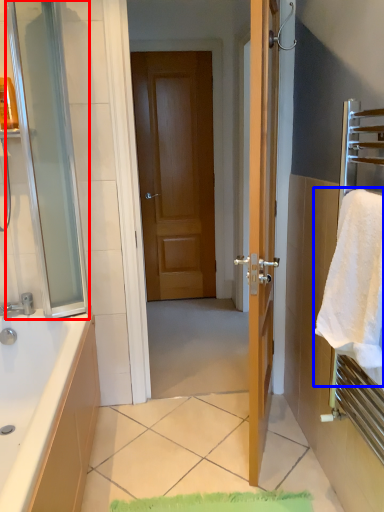
Question: Which of the following is the closest to the observer, screen door (highlighted by a red box) or beach towel (highlighted by a blue box)?

Choices:
 (A) screen door
 (B) beach towel

Answer: (B)